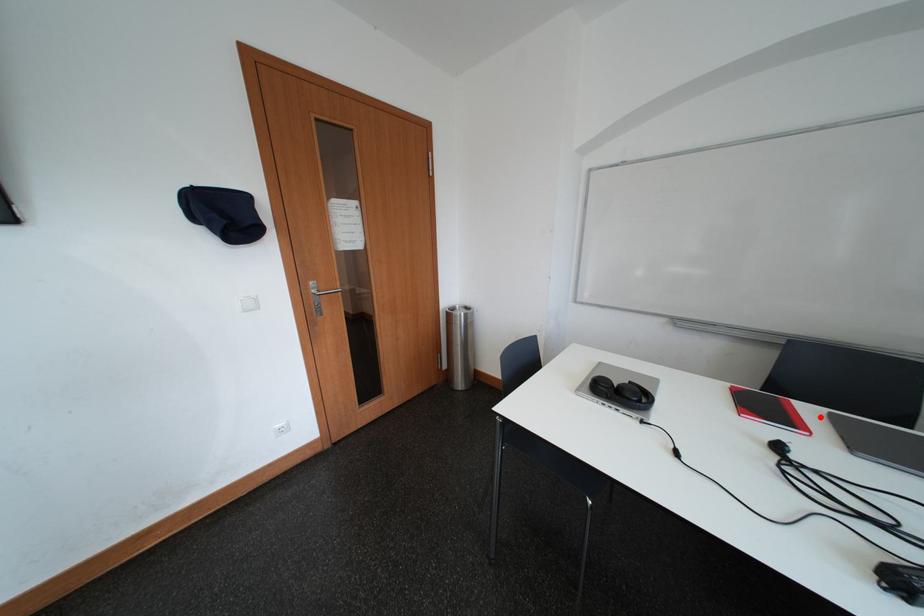
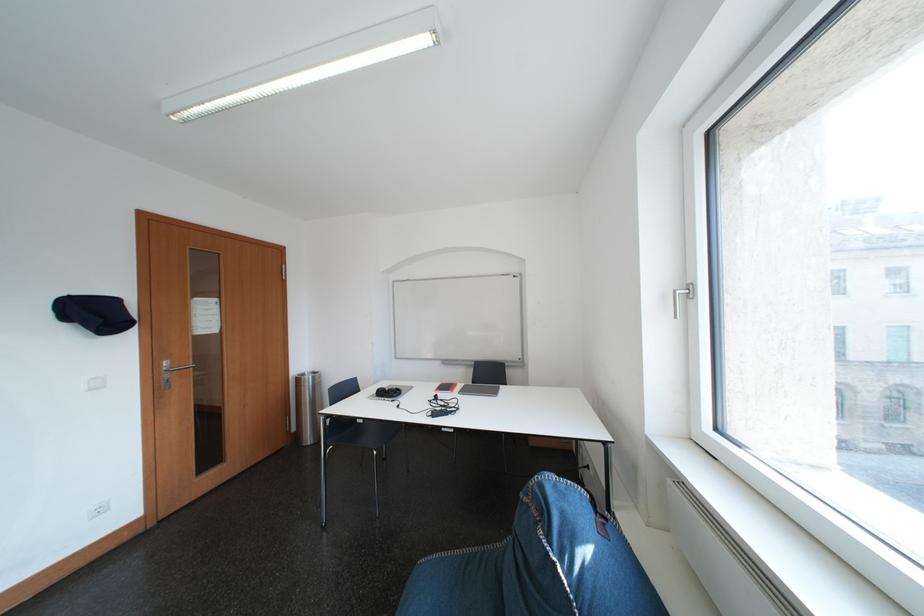
The point at the highlighted location is marked in the first image. Where is the corresponding point in the second image?

(470, 390)